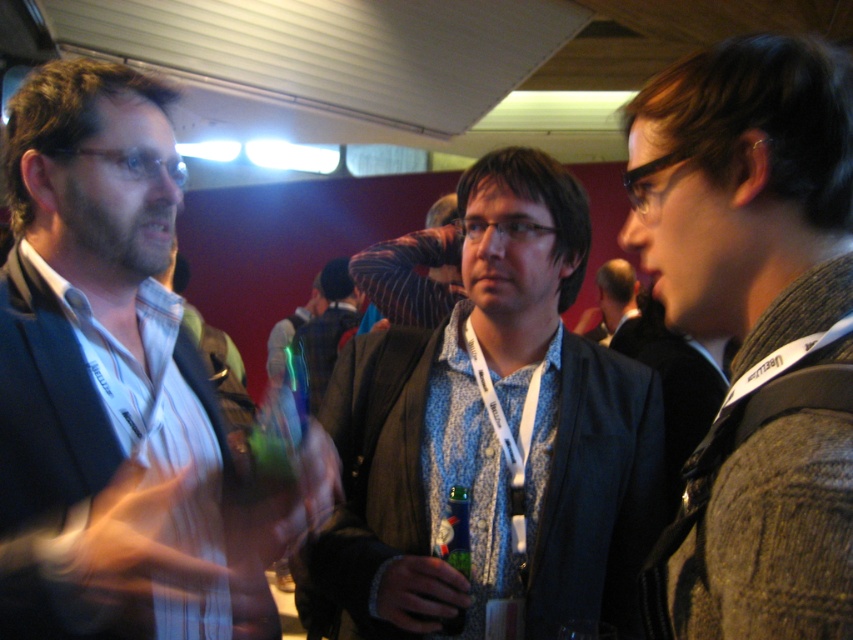
Question: Among these points, which one is farthest from the camera?

Choices:
 (A) (775, 429)
 (B) (321, 355)
 (C) (444, 556)

Answer: (B)

Question: Can you confirm if matte black jacket at left is positioned to the left of light brown leather jacket at center?

Choices:
 (A) no
 (B) yes

Answer: (A)

Question: Is blue patterned shirt at center wider than green matte bottle at center?

Choices:
 (A) no
 (B) yes

Answer: (B)

Question: From the image, what is the correct spatial relationship of knitted gray sweater at right in relation to green matte bottle at center?

Choices:
 (A) below
 (B) above

Answer: (B)

Question: Which object is positioned farthest from the green matte bottle at center?

Choices:
 (A) knitted gray sweater at right
 (B) blue patterned shirt at center
 (C) light brown leather jacket at center
 (D) matte black jacket at left

Answer: (C)

Question: Which object appears closest to the camera in this image?

Choices:
 (A) light brown leather jacket at center
 (B) blue patterned shirt at center
 (C) matte black jacket at left

Answer: (C)